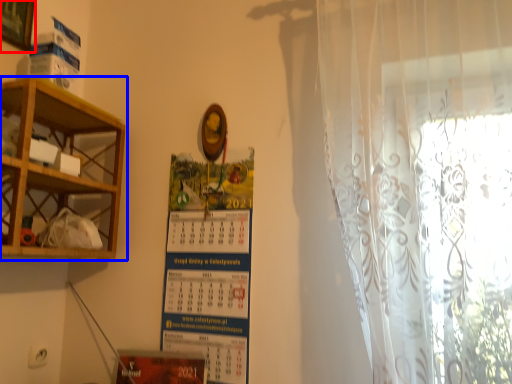
Question: Which object is further to the camera taking this photo, picture frame (highlighted by a red box) or shelf (highlighted by a blue box)?

Choices:
 (A) picture frame
 (B) shelf

Answer: (A)